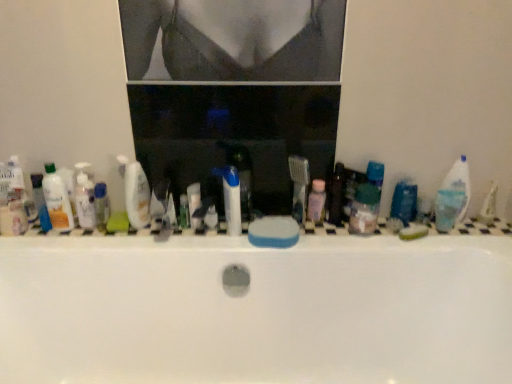
This screenshot has width=512, height=384. In order to click on vacant point above white plastic bottles at center (from a real-world perspective) in this screenshot , I will do `click(293, 217)`.